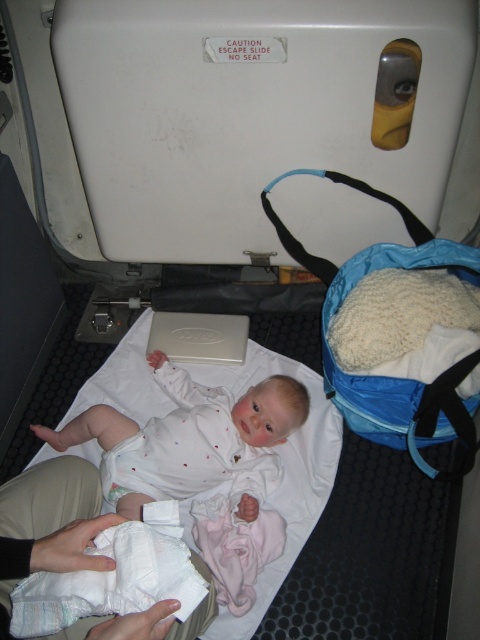
Question: Is white soft baby at center above white soft diaper at lower left?

Choices:
 (A) yes
 (B) no

Answer: (A)

Question: Can you confirm if white soft baby at center is bigger than white soft diaper at lower left?

Choices:
 (A) yes
 (B) no

Answer: (A)

Question: Does white soft baby at center appear under white soft diaper at lower left?

Choices:
 (A) yes
 (B) no

Answer: (B)